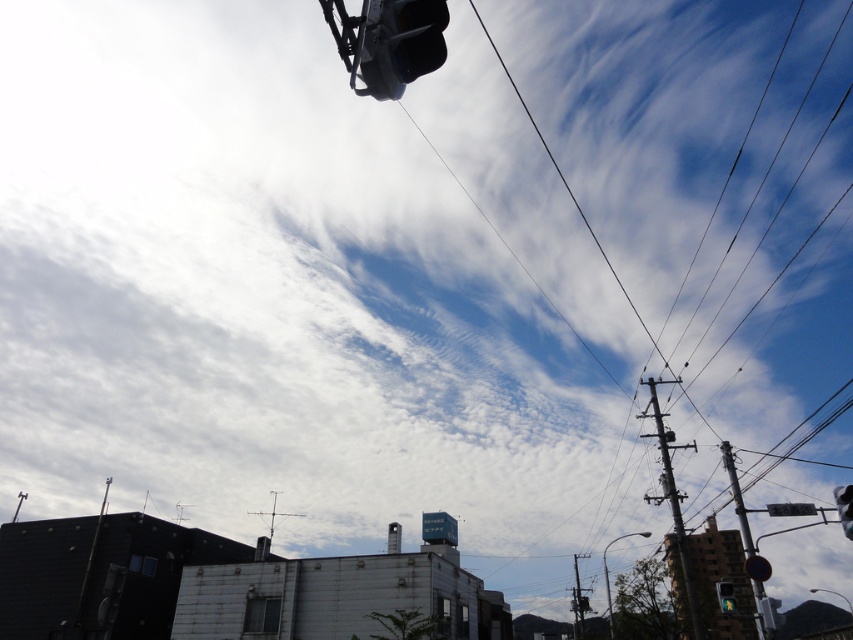
You are a city planner reviewing this urban scene. You need to determine the spatial relationship between the metallic pole at right and the metallic silver traffic light at upper right. Is the traffic light above or below the pole?

The metallic silver traffic light at upper right is above the metallic pole at right because the pole is positioned below it.